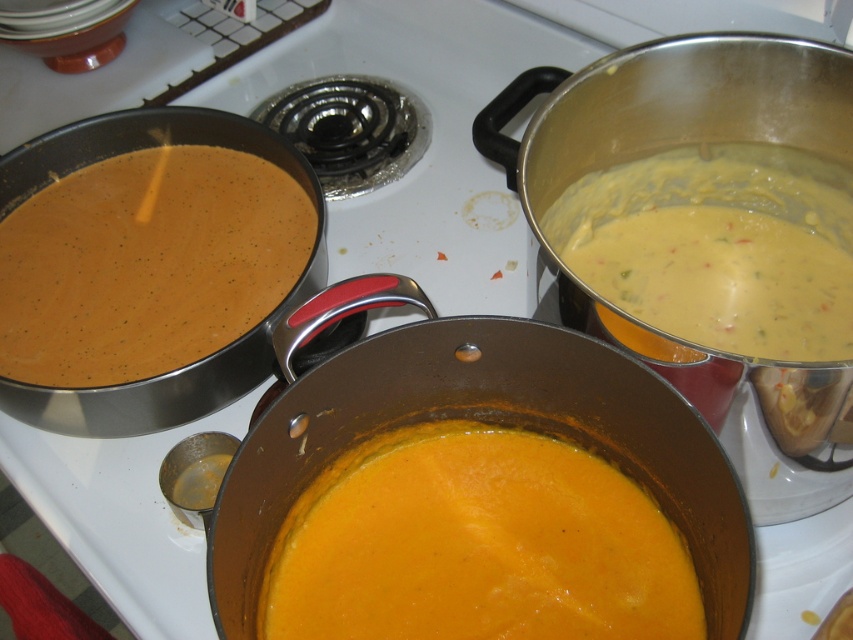
Between matte orange soup at center and yellow creamy soup at upper right, which one has less height?

With less height is matte orange soup at center.

Who is more distant from viewer, (376, 584) or (666, 305)?

The point (666, 305) is behind.

Which is behind, point (444, 540) or point (637, 276)?

The point (637, 276) is behind.

The image size is (853, 640). Find the location of `matte orange soup at center`. matte orange soup at center is located at coordinates (477, 545).

Who is more distant from viewer, (459, 515) or (229, 541)?

The point (459, 515) is more distant.

Does matte orange soup at center appear on the left side of matte stainless steel pot at center?

No, matte orange soup at center is not to the left of matte stainless steel pot at center.

The width and height of the screenshot is (853, 640). Describe the element at coordinates (477, 545) in the screenshot. I see `matte orange soup at center` at that location.

In order to click on matte orange soup at center in this screenshot , I will do `click(477, 545)`.

Identify the location of matte stainless steel pot at center. The image size is (853, 640). (461, 417).

Which is in front, point (635, 368) or point (433, 316)?

Point (635, 368)

The height and width of the screenshot is (640, 853). Identify the location of matte stainless steel pot at center. (461, 417).

Where is `matte stainless steel pot at center`? This screenshot has height=640, width=853. matte stainless steel pot at center is located at coordinates (461, 417).